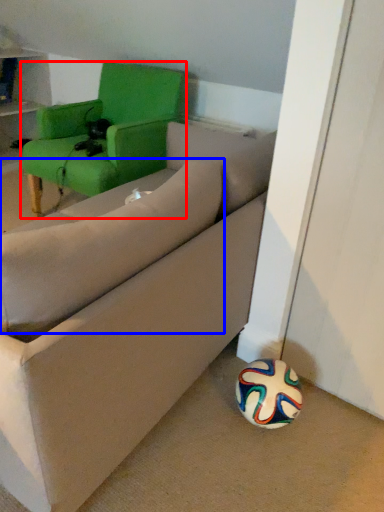
Question: Among these objects, which one is nearest to the camera, chair (highlighted by a red box) or pillow (highlighted by a blue box)?

Choices:
 (A) chair
 (B) pillow

Answer: (B)